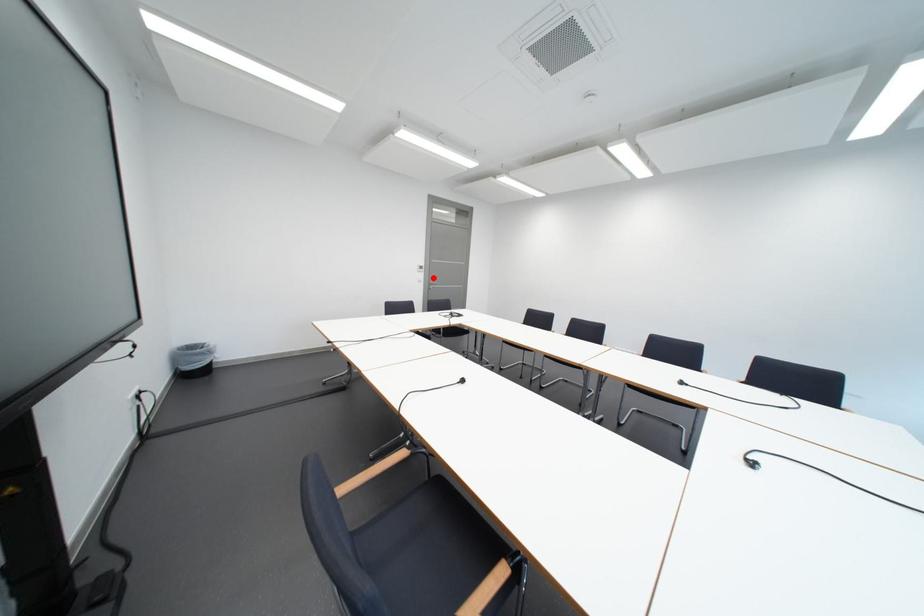
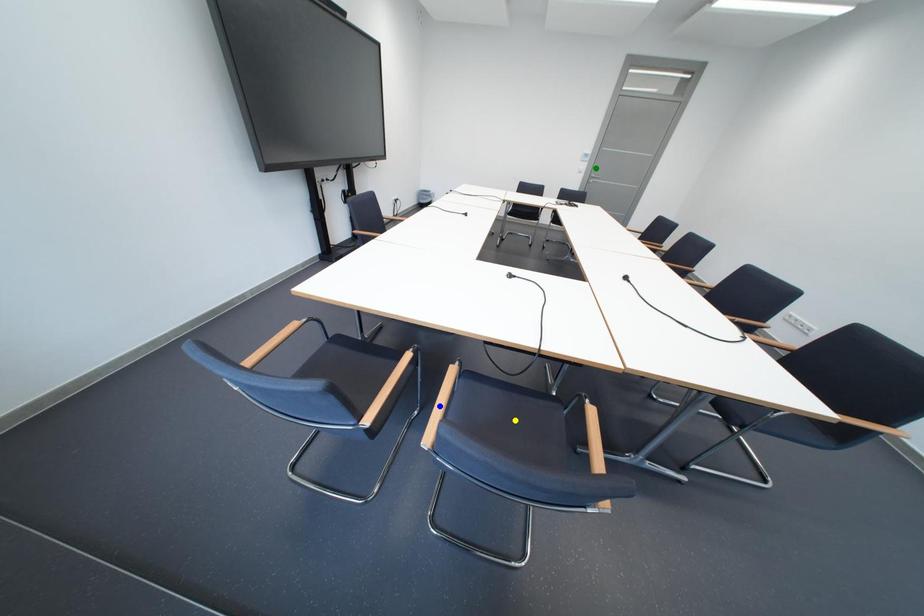
Question: I am providing you with two images of the same scene from different viewpoints. A red point is marked on the first image. You are given multiple points on the second image. Which point in image 2 represents the same 3d spot as the red point in image 1?

Choices:
 (A) blue point
 (B) yellow point
 (C) green point

Answer: (C)